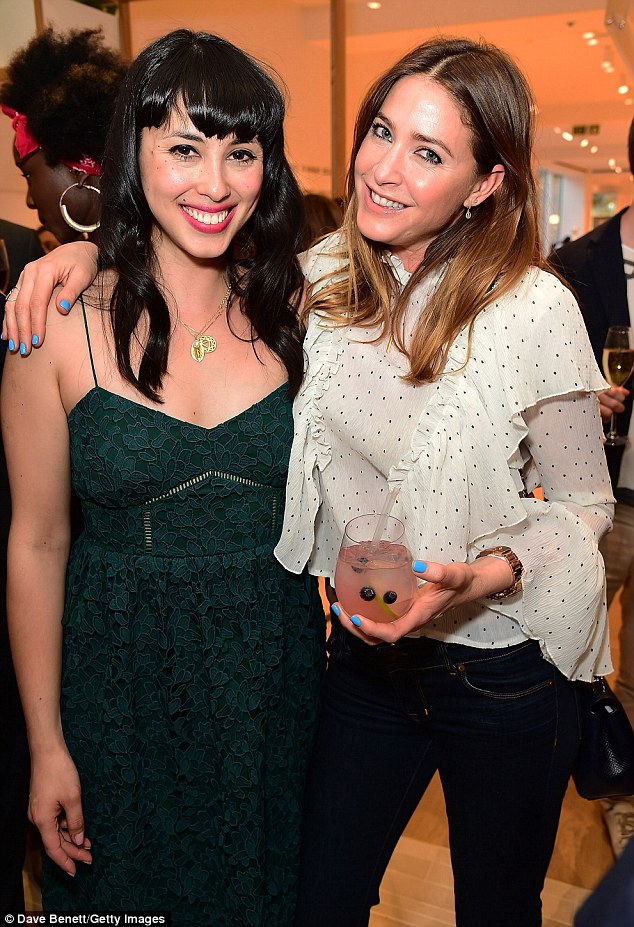
At what (x,y) coordinates should I click in order to perform the action: click on floor. Please return your answer as a coordinate pair (x, y). Looking at the image, I should click on (571, 849).